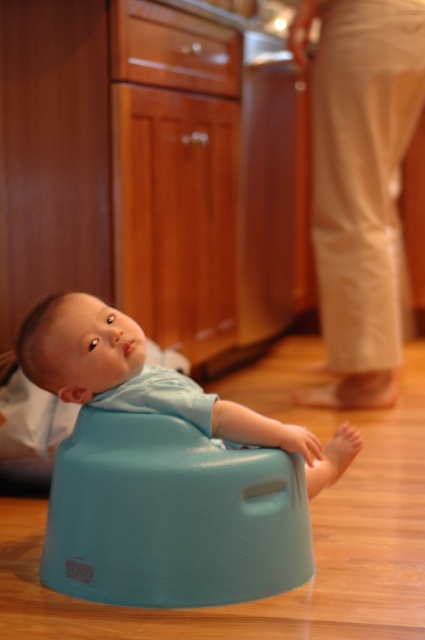
Is matte plastic bumbo seat at lower center wider than blue rubber baby seat at center?

No.

Find the location of a particular element. matte plastic bumbo seat at lower center is located at coordinates (172, 515).

Which is behind, point (303, 563) or point (280, 435)?

Point (303, 563)

Identify the location of matte plastic bumbo seat at lower center. (172, 515).